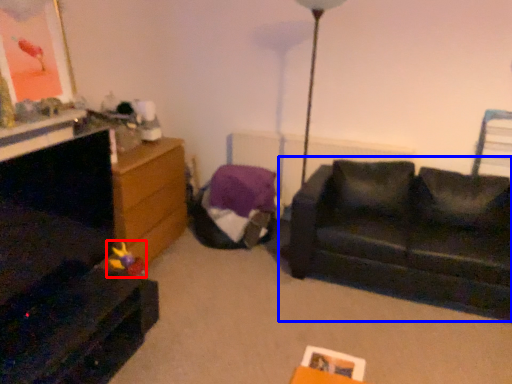
Question: Which object appears farthest to the camera in this image, toy (highlighted by a red box) or studio couch (highlighted by a blue box)?

Choices:
 (A) toy
 (B) studio couch

Answer: (A)